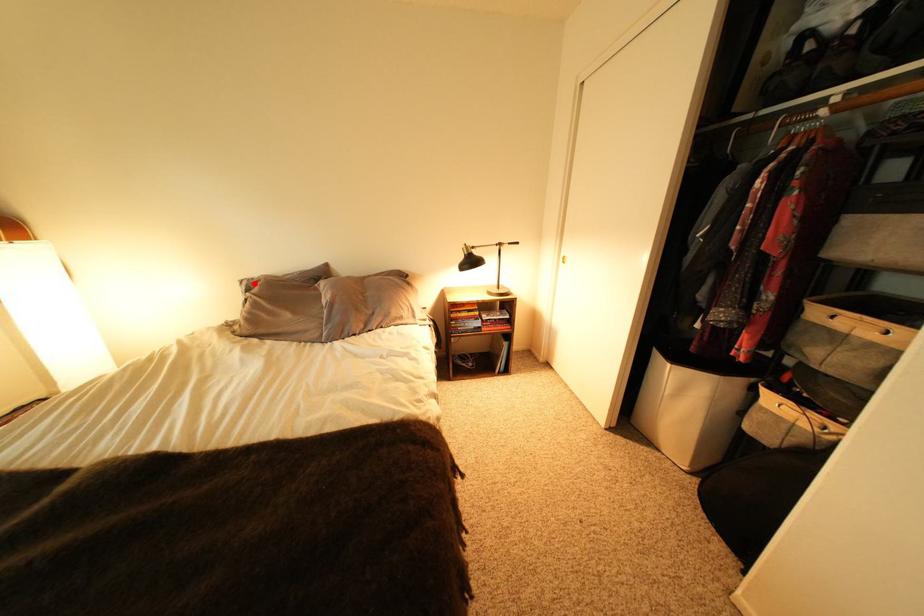
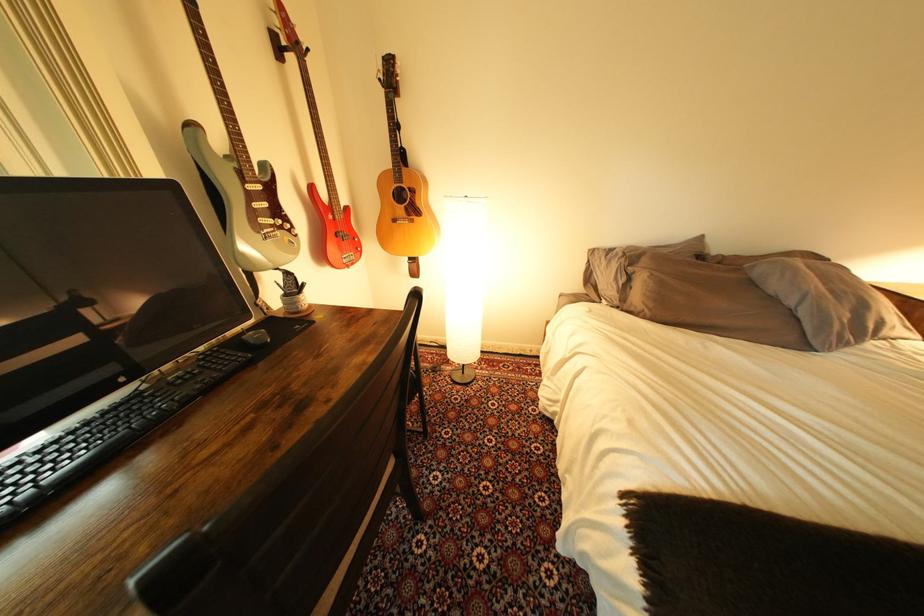
In the second image, find the point that corresponds to the highlighted location in the first image.

(604, 253)